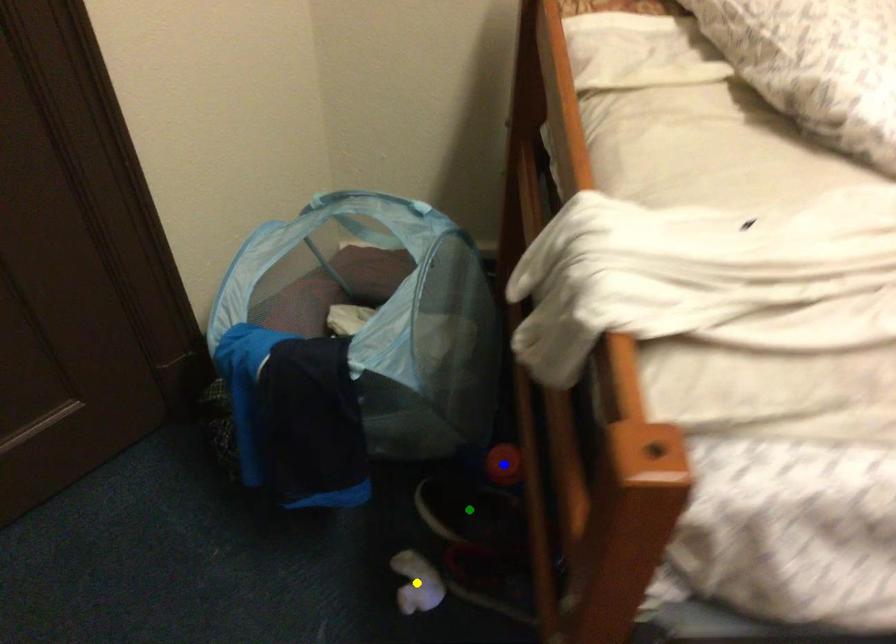
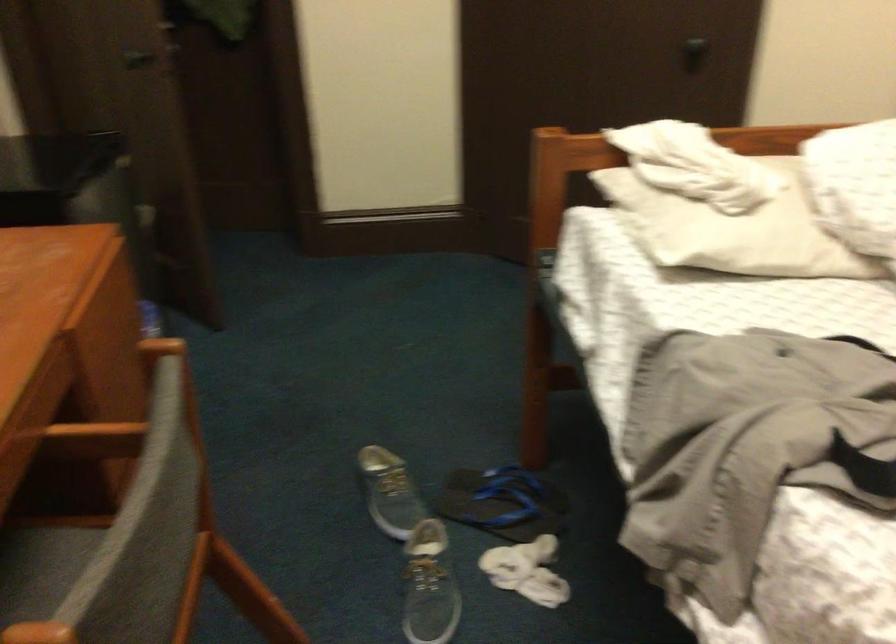
I am providing you with two images of the same scene from different viewpoints. Three points are marked in image1. Which point corresponds to a part or object that is occluded in image2?In image1, three points are marked. Which of them correspond to a part or object that is occluded in image2?Among the three points shown in image1, which one corresponds to a part or object that is no longer visible due to occlusion in image2?

Invisible in image2: blue point, green point, yellow point.